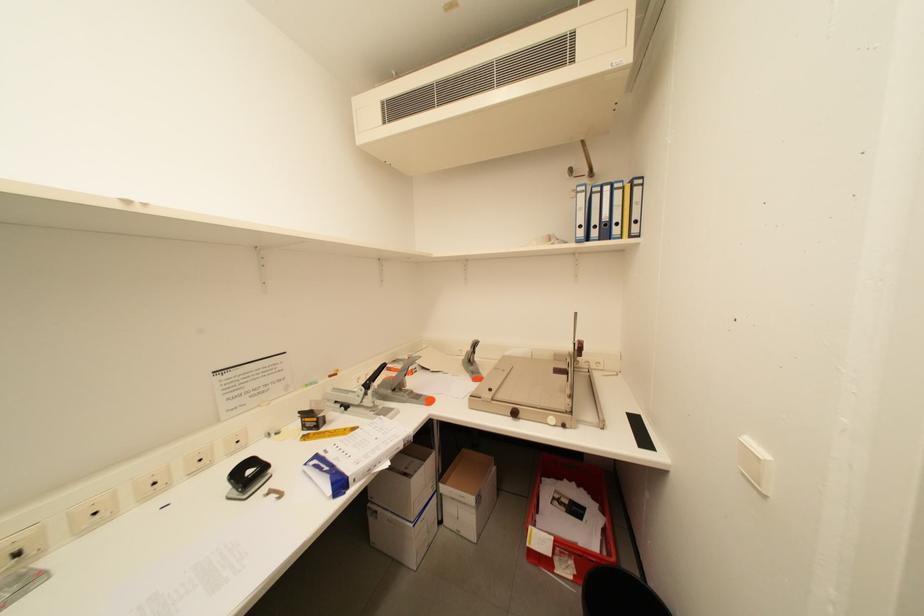
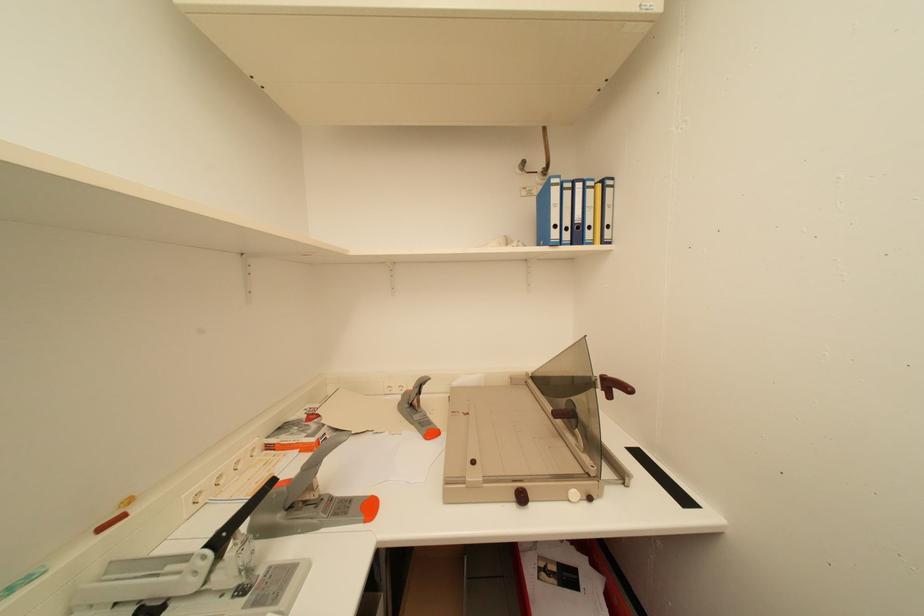
In a continuous first-person perspective shot, in which direction is the camera moving?

The cameraman walked toward left, forward.